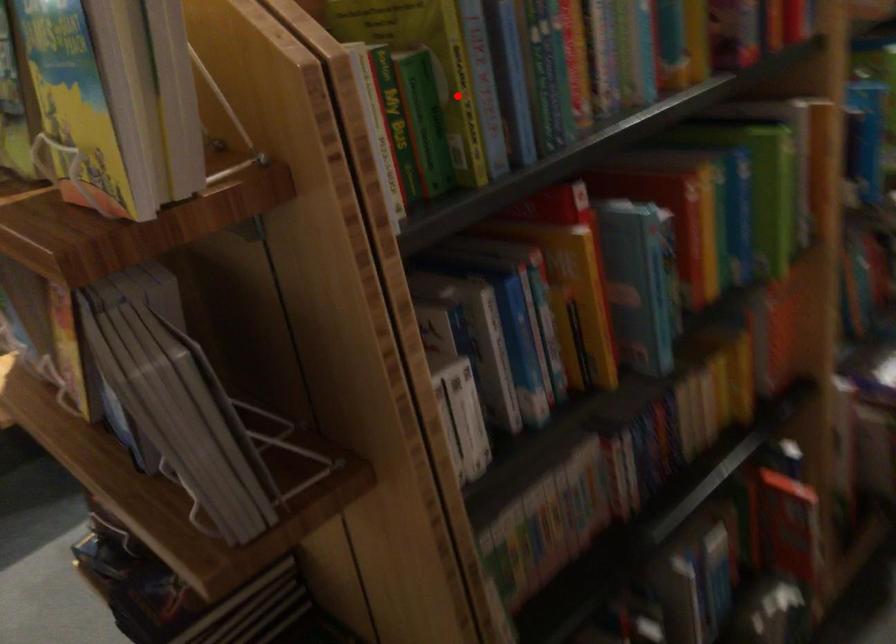
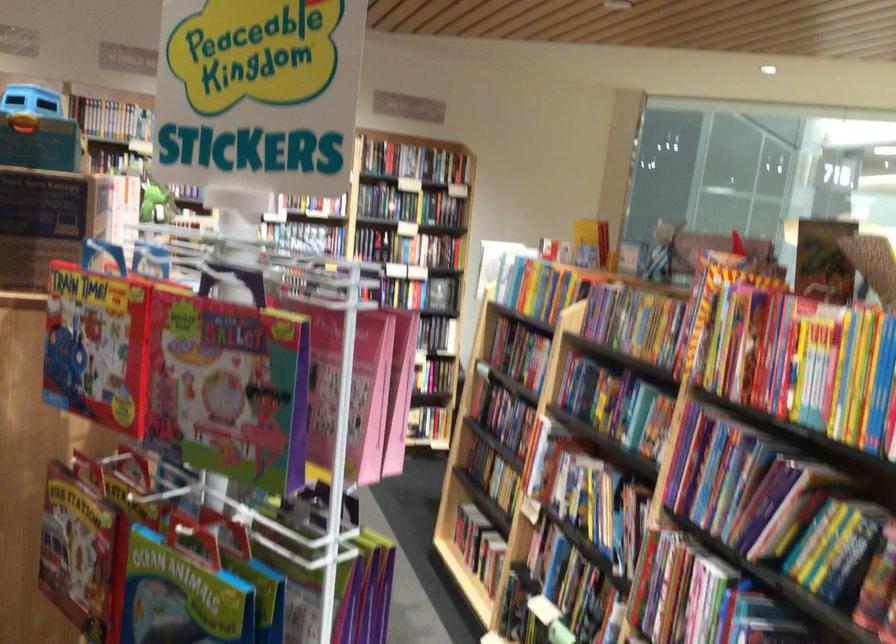
Question: I am providing you with two images of the same scene from different viewpoints. A red point is marked on the first image. Can you still see the location of the red point in image 2?

Choices:
 (A) Yes
 (B) No

Answer: (B)